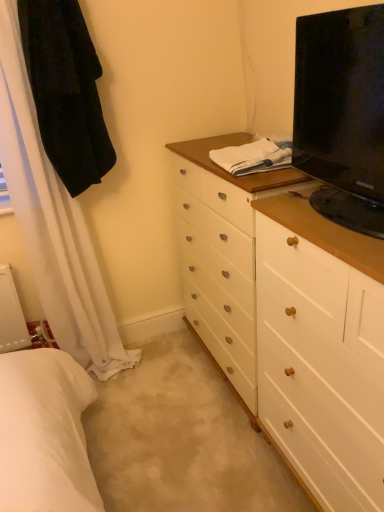
Question: Is black fabric robe at upper left taller or shorter than black glossy tv at upper right?

Choices:
 (A) tall
 (B) short

Answer: (A)

Question: Is black fabric robe at upper left wider or thinner than black glossy tv at upper right?

Choices:
 (A) thin
 (B) wide

Answer: (A)

Question: Considering the positions of black fabric robe at upper left and black glossy tv at upper right in the image, is black fabric robe at upper left bigger or smaller than black glossy tv at upper right?

Choices:
 (A) small
 (B) big

Answer: (A)

Question: From a real-world perspective, is black glossy tv at upper right positioned above or below black fabric robe at upper left?

Choices:
 (A) below
 (B) above

Answer: (A)

Question: Considering their positions, is black glossy tv at upper right located in front of or behind black fabric robe at upper left?

Choices:
 (A) front
 (B) behind

Answer: (A)

Question: Considering the positions of point (362, 226) and point (51, 120), is point (362, 226) closer or farther from the camera than point (51, 120)?

Choices:
 (A) closer
 (B) farther

Answer: (A)

Question: Based on their positions, is black glossy tv at upper right located to the left or right of black fabric robe at upper left?

Choices:
 (A) right
 (B) left

Answer: (A)